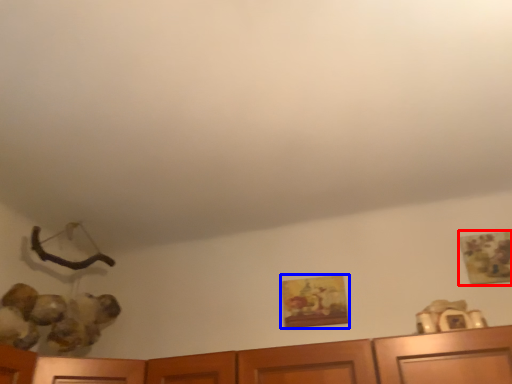
Question: Which object appears farthest to the camera in this image, picture frame (highlighted by a red box) or picture frame (highlighted by a blue box)?

Choices:
 (A) picture frame
 (B) picture frame

Answer: (B)